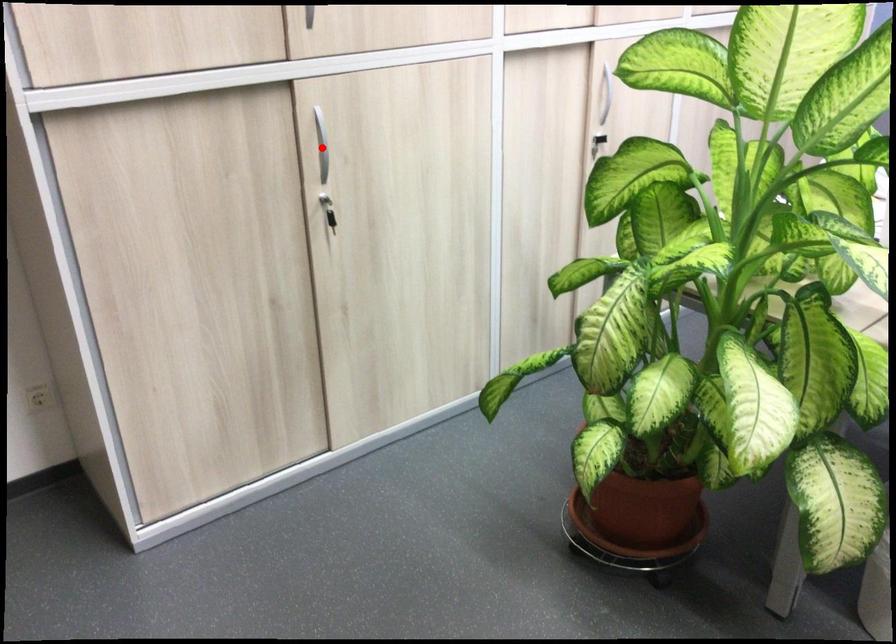
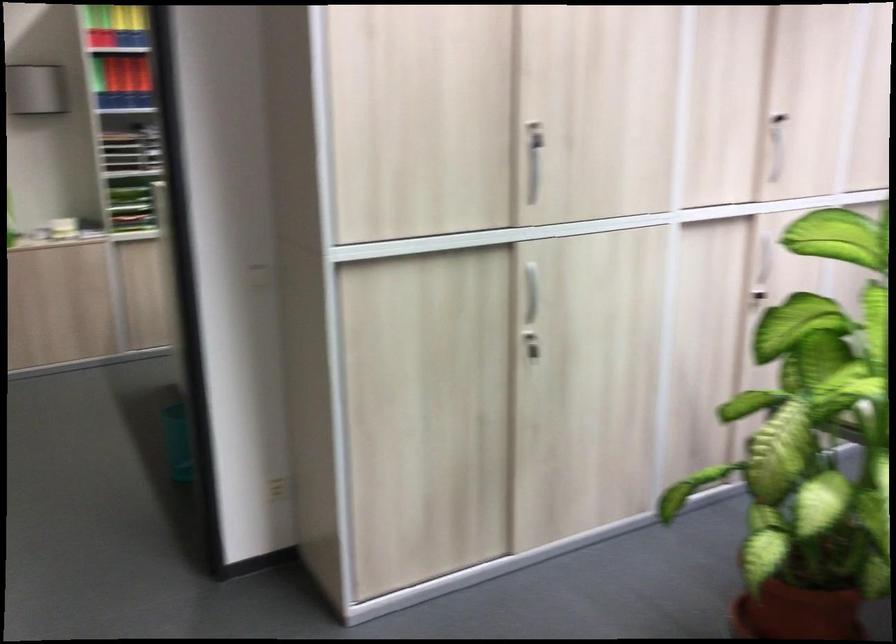
Question: I am providing you with two images of the same scene from different viewpoints. A red point is shown in image1. For the corresponding object point in image2, is it positioned nearer or farther from the camera?

Choices:
 (A) Nearer
 (B) Farther

Answer: (B)